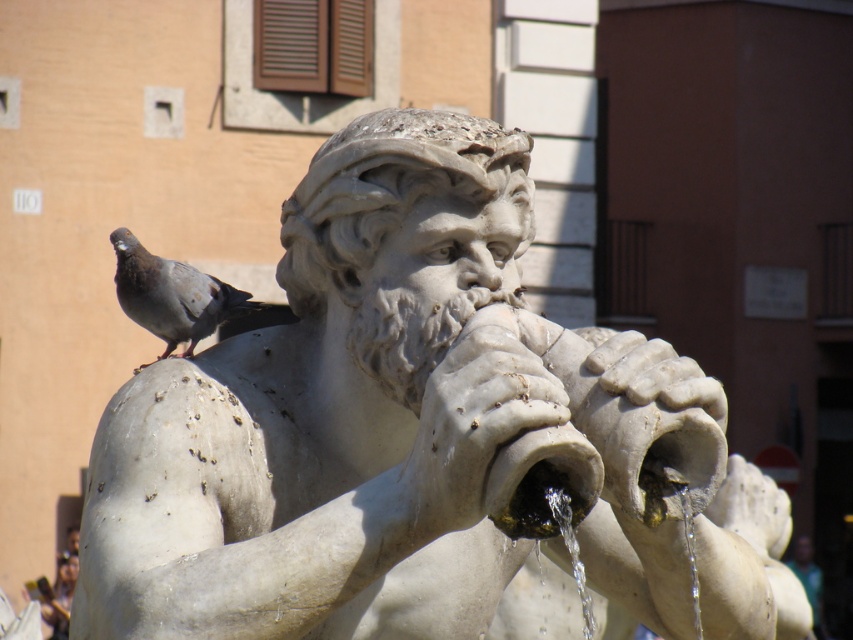
Based on the photo, is white marble statue at center to the left of gray matte pigeon at upper left from the viewer's perspective?

Incorrect, white marble statue at center is not on the left side of gray matte pigeon at upper left.

Who is lower down, white marble statue at center or gray matte pigeon at upper left?

white marble statue at center is below.

Image resolution: width=853 pixels, height=640 pixels. In order to click on white marble statue at center in this screenshot , I will do `click(378, 420)`.

Locate an element on the screen. This screenshot has width=853, height=640. white marble statue at center is located at coordinates (378, 420).